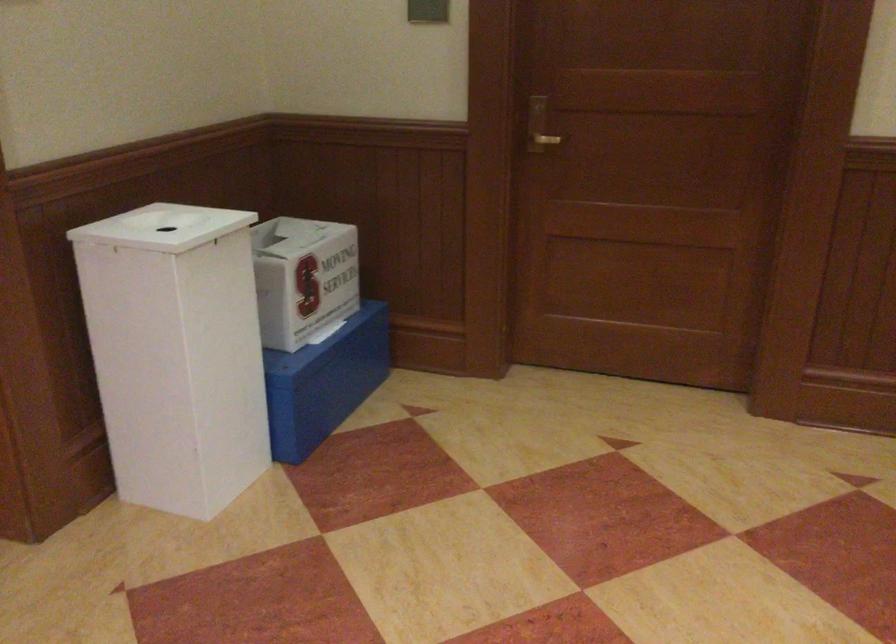
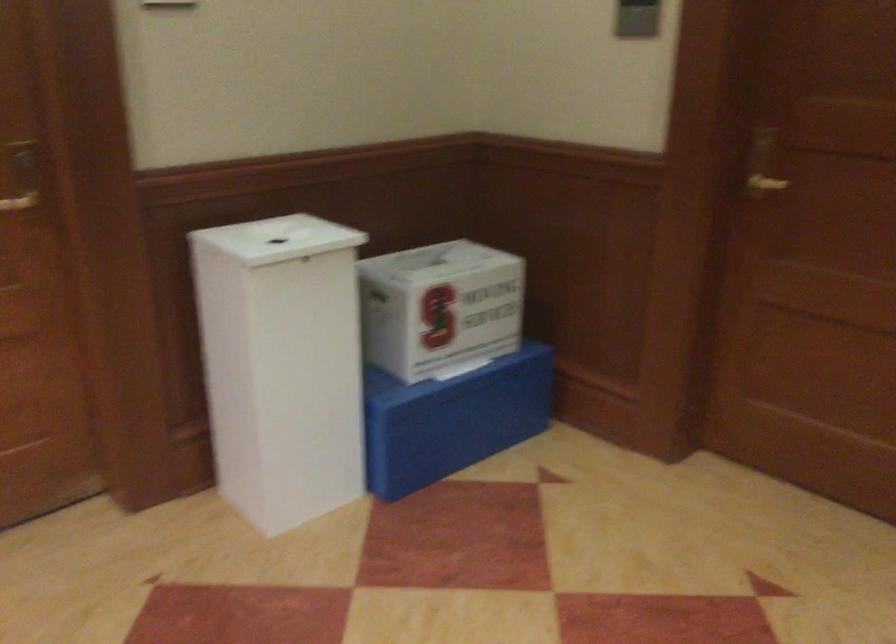
The point at (331, 377) is marked in the first image. Where is the corresponding point in the second image?

(452, 419)